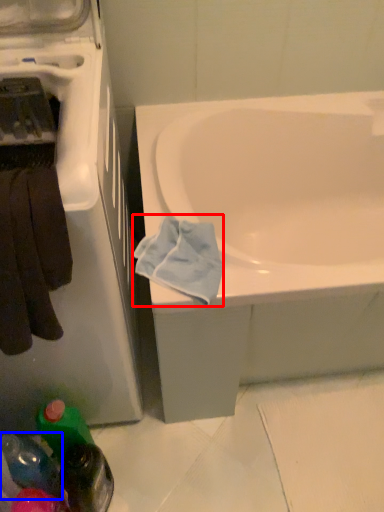
Question: Which object is further to the camera taking this photo, bath towel (highlighted by a red box) or bottle (highlighted by a blue box)?

Choices:
 (A) bath towel
 (B) bottle

Answer: (B)